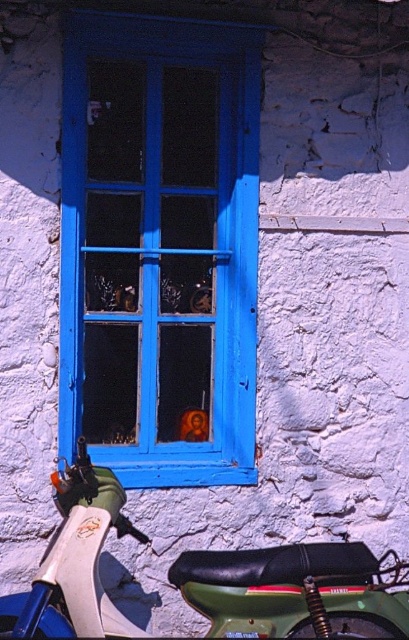
You are a painter who needs to place a 1.2 meter wide canvas between the blue painted wood at center and the green matte motorcycle at lower left. Can the canvas fit between them?

The blue painted wood at center is narrower than the green matte motorcycle at lower left, but the exact distance between them isn generated from the provided information. Therefore, it is uncertain if the 1.2 meter wide canvas can fit between them.

You are standing in front of the scene and want to move the green matte motorcycle at lower left closer to the blue painted wood at center. Based on their positions, which direction should you push the motorcycle to align it with the wood?

You should push the green matte motorcycle at lower left to the right to align it with the blue painted wood at center since the blue painted wood at center is to the left of the motorcycle.